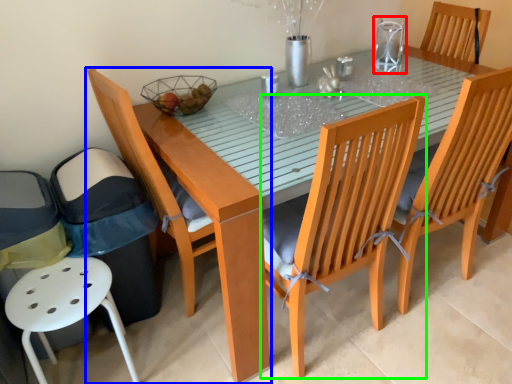
Question: Considering the real-world distances, which object is closest to clear (highlighted by a red box)? chair (highlighted by a blue box) or chair (highlighted by a green box).

Choices:
 (A) chair
 (B) chair

Answer: (B)